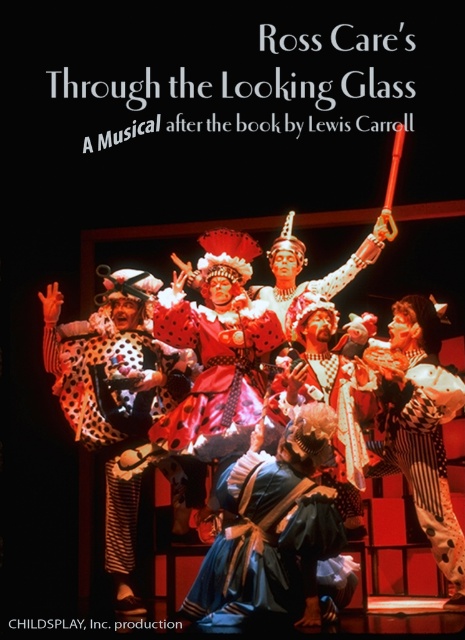
Is spotted fabric clown at center below white polka dot fabric at center?

No.

At what (x,y) coordinates should I click in order to perform the action: click on spotted fabric clown at center. Please return your answer as a coordinate pair (x, y). The width and height of the screenshot is (465, 640). Looking at the image, I should click on (119, 403).

Which of these two, spotted fabric clown at center or red polka dot fabric dress at center, stands shorter?

Standing shorter between the two is red polka dot fabric dress at center.

Can you confirm if spotted fabric clown at center is positioned to the right of red polka dot fabric dress at center?

In fact, spotted fabric clown at center is to the left of red polka dot fabric dress at center.

Locate an element on the screen. spotted fabric clown at center is located at coordinates (119, 403).

In the scene shown: Between red polka dot fabric dress at center and white polka dot fabric at center, which one is positioned higher?

red polka dot fabric dress at center

Is point (199, 340) in front of point (434, 474)?

No, (199, 340) is behind (434, 474).

What do you see at coordinates (216, 371) in the screenshot? This screenshot has width=465, height=640. I see `red polka dot fabric dress at center` at bounding box center [216, 371].

Locate an element on the screen. Image resolution: width=465 pixels, height=640 pixels. red polka dot fabric dress at center is located at coordinates (216, 371).